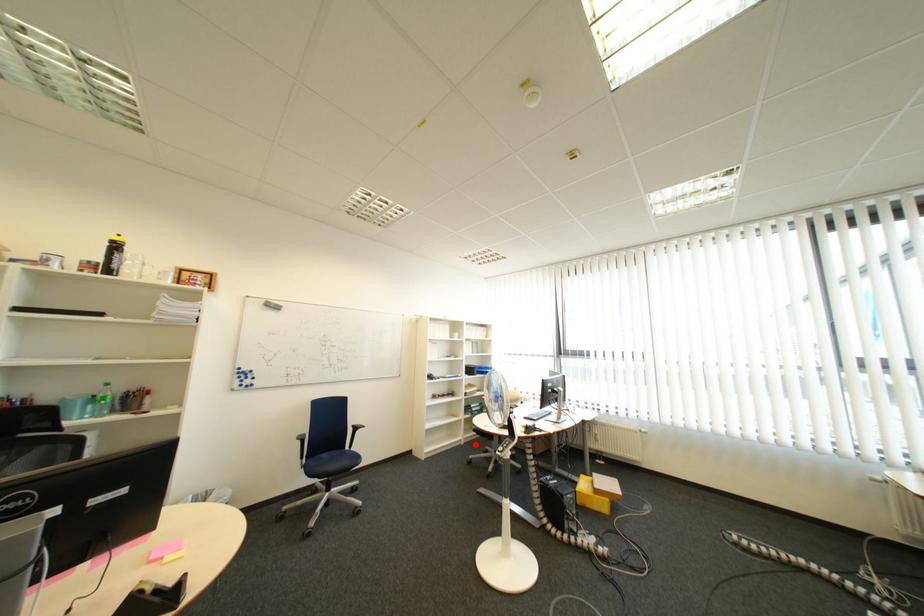
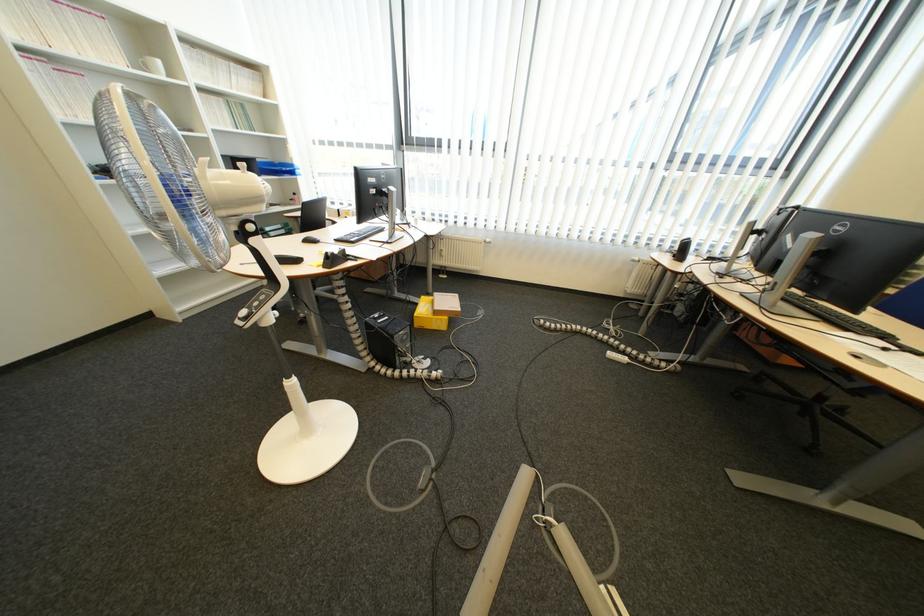
In the second image, find the point that corresponds to the highlighted location in the first image.

(277, 285)